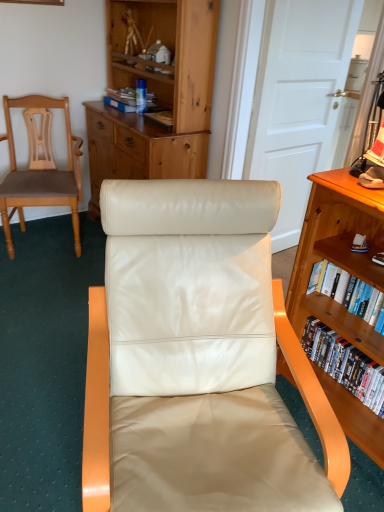
Question: Is white wood door at upper center shorter than matte cardboard book at upper center, positioned as the first book in top-to-bottom order?

Choices:
 (A) no
 (B) yes

Answer: (A)

Question: Can you confirm if white wood door at upper center is thinner than matte cardboard book at upper center, positioned as the first book in back-to-front order?

Choices:
 (A) yes
 (B) no

Answer: (A)

Question: Is matte cardboard book at upper center, the 1th book positioned from the left, completely or partially inside white wood door at upper center?

Choices:
 (A) yes
 (B) no

Answer: (B)

Question: Is the position of white wood door at upper center more distant than that of matte cardboard book at upper center, positioned as the first book in top-to-bottom order?

Choices:
 (A) yes
 (B) no

Answer: (B)

Question: Does white wood door at upper center have a greater height compared to matte cardboard book at upper center, positioned as the first book in top-to-bottom order?

Choices:
 (A) no
 (B) yes

Answer: (B)

Question: Is matte brown wood chair at left, the first chair in the left-to-right sequence, in front of or behind white glossy bookshelf at right, arranged as the 2th book when viewed from the front, in the image?

Choices:
 (A) front
 (B) behind

Answer: (B)

Question: In terms of height, does matte brown wood chair at left, which is the second chair from front to back, look taller or shorter compared to white glossy bookshelf at right, positioned as the 2th book in back-to-front order?

Choices:
 (A) short
 (B) tall

Answer: (B)

Question: Looking at their shapes, would you say matte brown wood chair at left, which is the first chair in back-to-front order, is wider or thinner than white glossy bookshelf at right, marked as the third book in a left-to-right arrangement?

Choices:
 (A) thin
 (B) wide

Answer: (B)

Question: From a real-world perspective, is matte brown wood chair at left, the first chair in the left-to-right sequence, physically located above or below white glossy bookshelf at right, arranged as the first book when ordered from the bottom?

Choices:
 (A) above
 (B) below

Answer: (A)

Question: Choose the correct answer: Is matte cardboard book at upper center, the 3th book when ordered from right to left, inside matte brown wood chair at left, the first chair in the left-to-right sequence, or outside it?

Choices:
 (A) inside
 (B) outside

Answer: (B)

Question: Considering the positions of matte cardboard book at upper center, the 3th book when ordered from right to left, and matte brown wood chair at left, the second chair viewed from the right, in the image, is matte cardboard book at upper center, the 3th book when ordered from right to left, taller or shorter than matte brown wood chair at left, the second chair viewed from the right,?

Choices:
 (A) short
 (B) tall

Answer: (A)

Question: Would you say matte cardboard book at upper center, positioned as the first book in top-to-bottom order, is to the left or to the right of matte brown wood chair at left, the second chair viewed from the right, in the picture?

Choices:
 (A) left
 (B) right

Answer: (B)

Question: Does point (109, 103) appear closer or farther from the camera than point (8, 251)?

Choices:
 (A) farther
 (B) closer

Answer: (A)

Question: Is white wood door at upper center wider or thinner than matte cardboard book at upper center, marked as the third book in a bottom-to-top arrangement?

Choices:
 (A) wide
 (B) thin

Answer: (B)

Question: Is white wood door at upper center bigger or smaller than matte cardboard book at upper center, positioned as the first book in top-to-bottom order?

Choices:
 (A) big
 (B) small

Answer: (A)